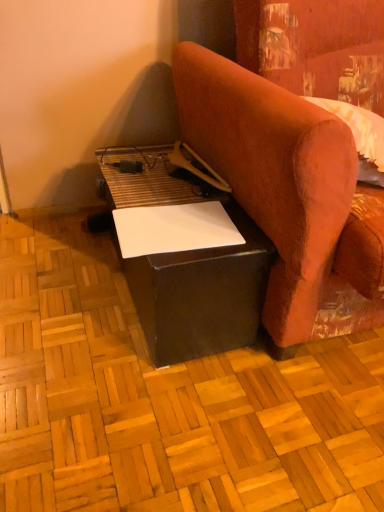
Question: In terms of size, does black matte table at lower center appear bigger or smaller than white paper at lower center?

Choices:
 (A) small
 (B) big

Answer: (B)

Question: In terms of width, does black matte table at lower center look wider or thinner when compared to white paper at lower center?

Choices:
 (A) thin
 (B) wide

Answer: (B)

Question: Estimate the real-world distances between objects in this image. Which object is closer to the black matte table at lower center?

Choices:
 (A) matte black plywood at center
 (B) velvet-like orange armchair at right
 (C) white paper at lower center

Answer: (C)

Question: Which object is the closest to the velvet-like orange armchair at right?

Choices:
 (A) white paper at lower center
 (B) matte black plywood at center
 (C) black matte table at lower center

Answer: (C)